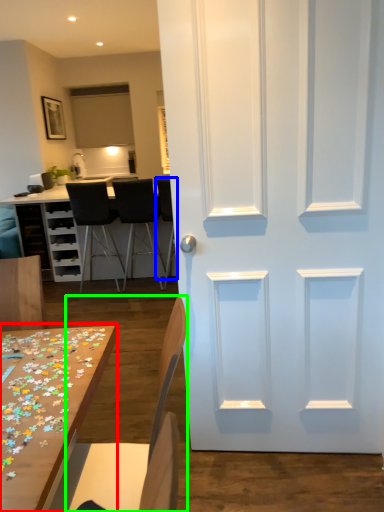
Question: Considering the real-world distances, which object is closest to table (highlighted by a red box)? chair (highlighted by a blue box) or chair (highlighted by a green box).

Choices:
 (A) chair
 (B) chair

Answer: (B)